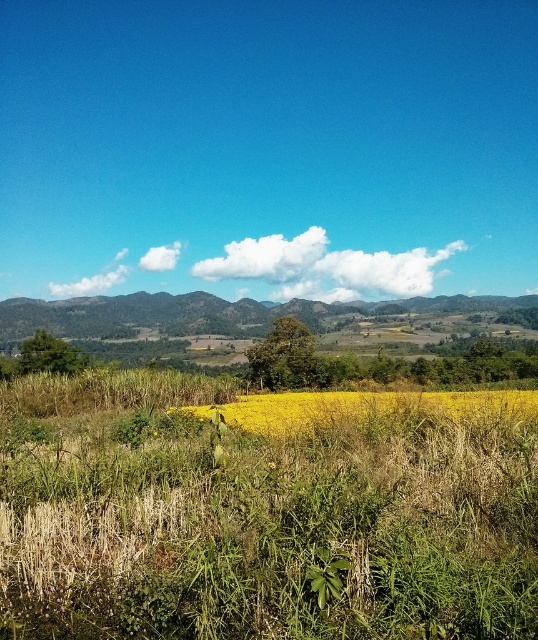
Between point (253, 259) and point (332, 560), which one is positioned in front?

Positioned in front is point (332, 560).

At what (x,y) coordinates should I click in order to perform the action: click on white fluffy cloud at upper center. Please return your answer as a coordinate pair (x, y). The width and height of the screenshot is (538, 640). Looking at the image, I should click on (324, 268).

Measure the distance between point (341, 275) and camera.

Point (341, 275) is 81.96 meters from camera.

This screenshot has width=538, height=640. I want to click on white fluffy cloud at upper center, so click(324, 268).

Does white fluffy cloud at upper center appear over yellow grass at center?

Indeed, white fluffy cloud at upper center is positioned over yellow grass at center.

Image resolution: width=538 pixels, height=640 pixels. Find the location of `white fluffy cloud at upper center`. white fluffy cloud at upper center is located at coordinates (324, 268).

Image resolution: width=538 pixels, height=640 pixels. Identify the location of white fluffy cloud at upper center. (324, 268).

Who is higher up, yellow grass at center or green leafy weed at center?

green leafy weed at center

Between point (275, 397) and point (320, 582), which one is positioned in front?

Point (320, 582)

You are a GUI agent. You are given a task and a screenshot of the screen. Output one action in this format:
    pyautogui.click(x=<x>, y=<y>)
    Task: Click on the yellow grass at center
    Image resolution: width=538 pixels, height=640 pixels.
    Given the screenshot: What is the action you would take?
    pyautogui.click(x=360, y=406)

The width and height of the screenshot is (538, 640). Identify the location of yellow grass at center. (360, 406).